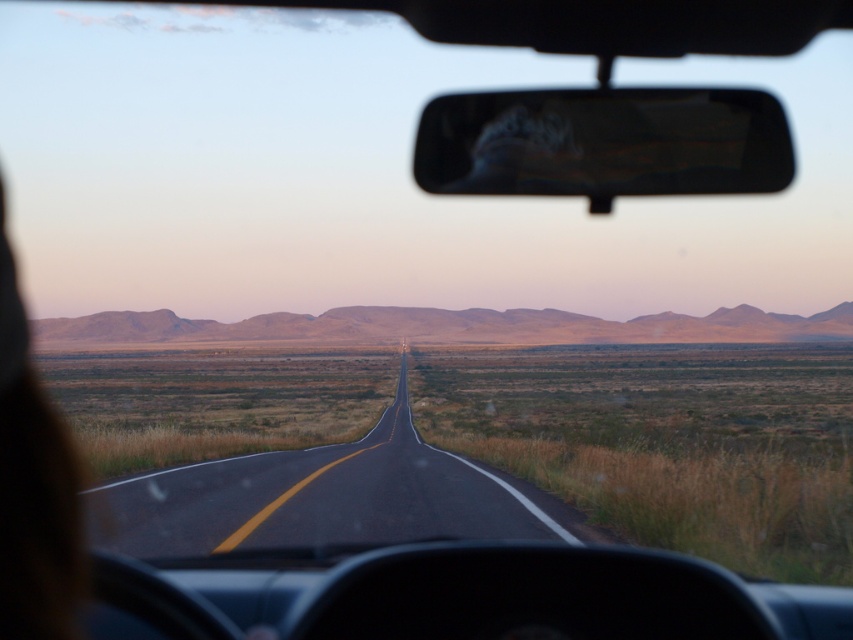
You are a driver navigating a desert road and need to stay in your lane. Where exactly is the asphalt road at center located in the image?

The asphalt road at center is located at the 2D point coordinates of 0.780 in the x axis and 0.381 in the y axis.

You are driving a car and want to know if the asphalt road at center is wider than the black glossy view mirror at upper center. Can you confirm this?

The asphalt road at center is wider than the black glossy view mirror at upper center according to the description.

You are driving a car and want to check your blind spot using the rearview mirror. The asphalt road at center and the black glossy view mirror at upper center are in your line of sight. Which object is closer to you?

The asphalt road at center is closer to you since it is 12.40 meters away from the black glossy view mirror at upper center, meaning the road is nearer to your position in the driver seat.